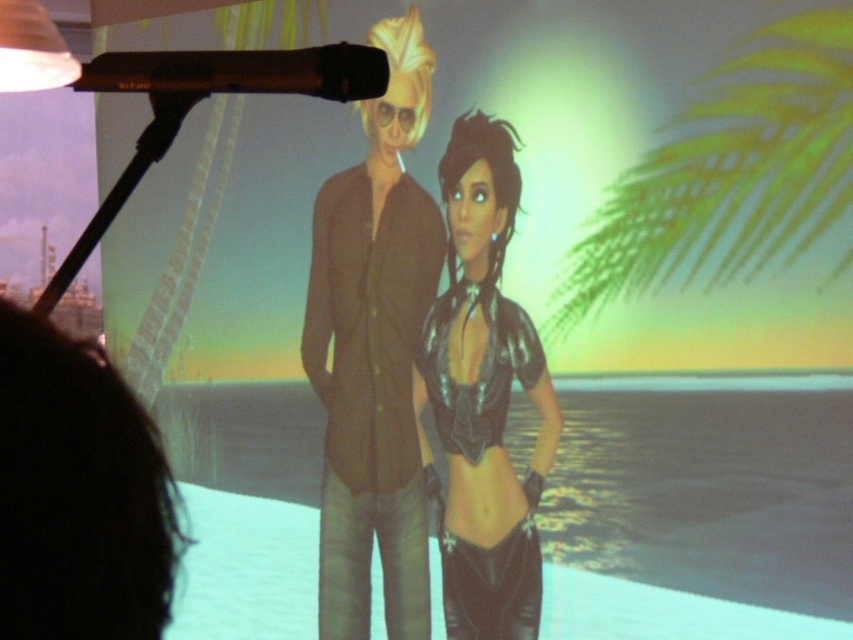
Question: Is black matte microphone at upper left behind matte white lampshade at upper left?

Choices:
 (A) no
 (B) yes

Answer: (A)

Question: Which object is farther from the camera taking this photo?

Choices:
 (A) black matte microphone at upper left
 (B) shiny metallic top at center
 (C) matte brown shirt at center

Answer: (C)

Question: Does black matte microphone at upper left appear over matte white lampshade at upper left?

Choices:
 (A) no
 (B) yes

Answer: (A)

Question: Which of the following is the closest to the observer?

Choices:
 (A) (6, 44)
 (B) (274, 51)
 (C) (405, 451)
 (D) (476, 570)

Answer: (B)

Question: Can you confirm if shiny metallic top at center is positioned to the left of black matte microphone at upper left?

Choices:
 (A) no
 (B) yes

Answer: (A)

Question: Among these objects, which one is farthest from the camera?

Choices:
 (A) black matte microphone at upper left
 (B) matte brown shirt at center

Answer: (B)